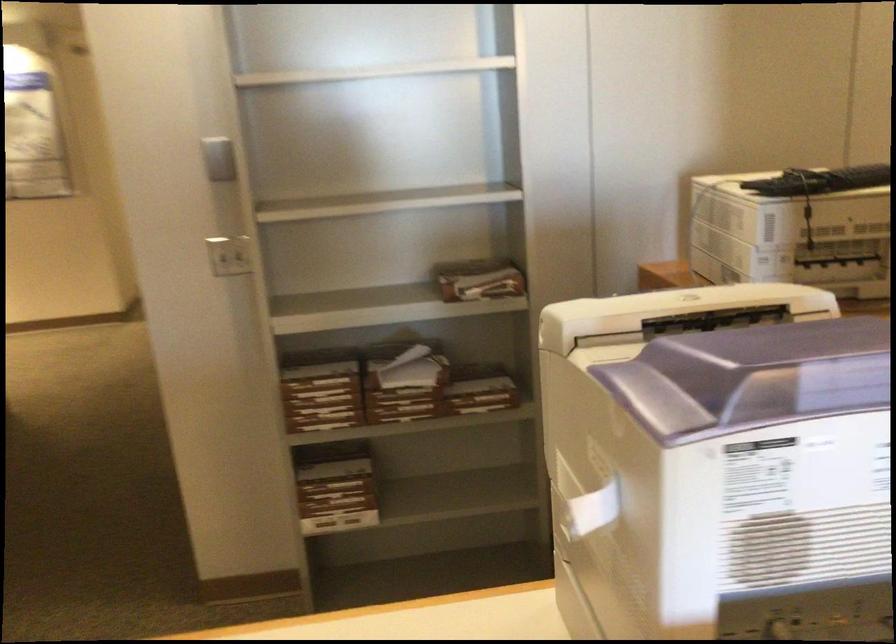
Find where to plugg the wall power outlet. Please return your answer as a coordinate pair (x, y).

(228, 254)